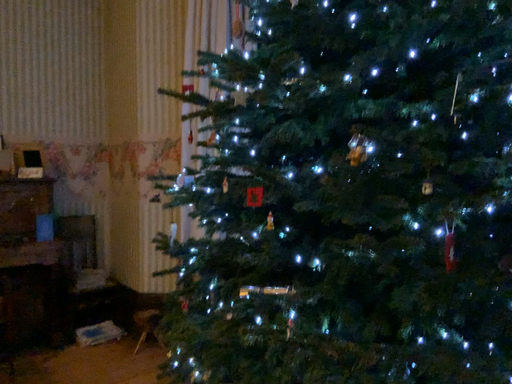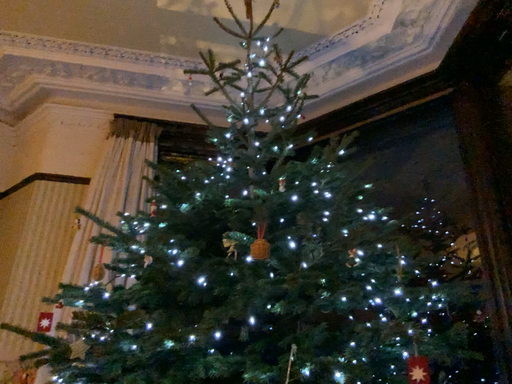
Question: Which way did the camera rotate in the video?

Choices:
 (A) rotated upward
 (B) rotated downward

Answer: (A)